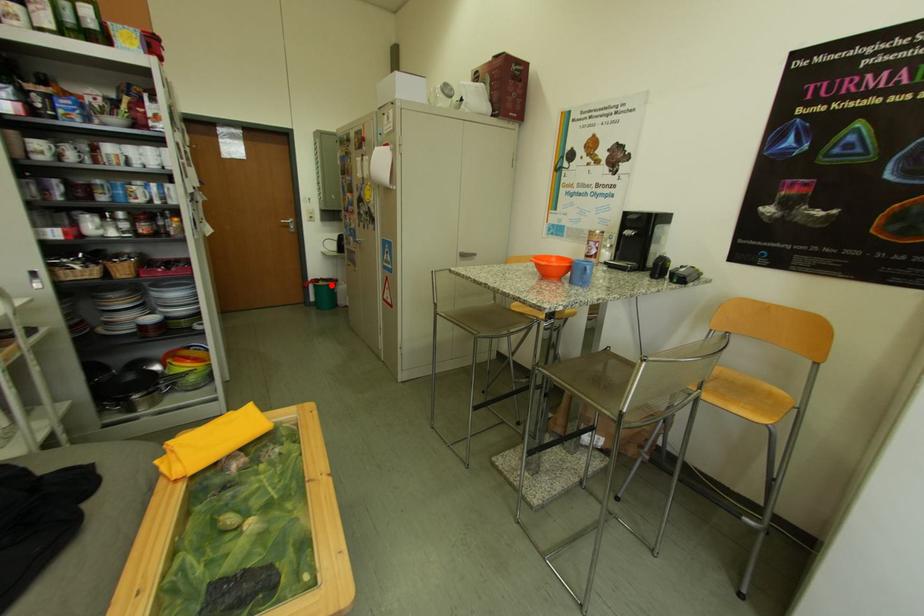
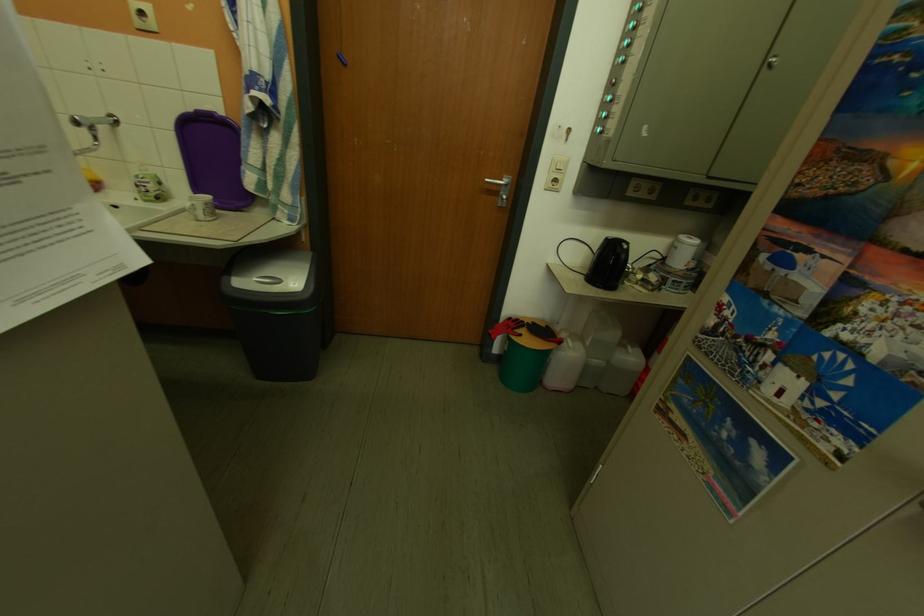
Question: A red point is marked in image1. In image2, is the corresponding 3D point closer to the camera or farther? Reply with the corresponding letter.

Choices:
 (A) The corresponding 3D point is closer.
 (B) The corresponding 3D point is farther.

Answer: (A)